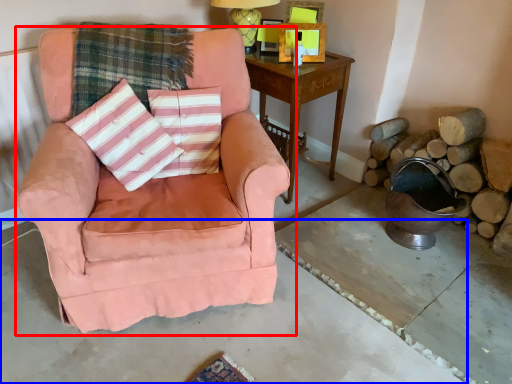
Question: Which point is closer to the camera, chair (highlighted by a red box) or concrete (highlighted by a blue box)?

Choices:
 (A) chair
 (B) concrete

Answer: (B)